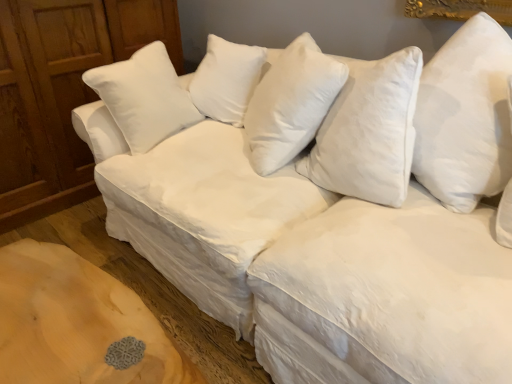
Question: Is white soft pillow at center, the 2th pillow viewed from the front, not near white soft pillow at upper right, the second pillow positioned from the back?

Choices:
 (A) no
 (B) yes

Answer: (A)

Question: Is white soft pillow at center, the 2th pillow viewed from the front, positioned behind white soft pillow at upper right, marked as the 1th pillow in a right-to-left arrangement?

Choices:
 (A) no
 (B) yes

Answer: (B)

Question: Would you say white soft pillow at center, the 1th pillow from the left, is outside white soft pillow at upper right, marked as the 1th pillow in a right-to-left arrangement?

Choices:
 (A) yes
 (B) no

Answer: (A)

Question: Can you confirm if white soft pillow at center, the 2th pillow viewed from the front, is positioned to the left of white soft pillow at upper right, which is counted as the 2th pillow, starting from the left?

Choices:
 (A) yes
 (B) no

Answer: (A)

Question: From the image's perspective, is white soft pillow at center, the 2th pillow viewed from the front, above white soft pillow at upper right, marked as the 1th pillow in a right-to-left arrangement?

Choices:
 (A) yes
 (B) no

Answer: (A)

Question: Based on their positions, is wooden dresser at left located to the left or right of white soft pillow at center, the 2th pillow viewed from the front?

Choices:
 (A) right
 (B) left

Answer: (B)

Question: In terms of height, does wooden dresser at left look taller or shorter compared to white soft pillow at center, the second pillow when ordered from right to left?

Choices:
 (A) short
 (B) tall

Answer: (B)

Question: Is point (87, 96) positioned closer to the camera than point (335, 86)?

Choices:
 (A) farther
 (B) closer

Answer: (A)

Question: From a real-world perspective, is wooden dresser at left above or below white soft pillow at center, the 1th pillow positioned from the back?

Choices:
 (A) above
 (B) below

Answer: (B)

Question: Considering the positions of point (273, 125) and point (134, 16), is point (273, 125) closer or farther from the camera than point (134, 16)?

Choices:
 (A) farther
 (B) closer

Answer: (B)

Question: Based on their positions, is white soft pillow at center, the 2th pillow viewed from the front, located to the left or right of wooden dresser at left?

Choices:
 (A) left
 (B) right

Answer: (B)

Question: From the image's perspective, relative to wooden dresser at left, is white soft pillow at center, the 1th pillow from the left, above or below?

Choices:
 (A) below
 (B) above

Answer: (A)

Question: In terms of size, does white soft pillow at center, the second pillow when ordered from right to left, appear bigger or smaller than wooden dresser at left?

Choices:
 (A) small
 (B) big

Answer: (A)

Question: From a real-world perspective, is white soft pillow at center, the second pillow when ordered from right to left, positioned above or below white soft pillow at upper right, which is counted as the 2th pillow, starting from the left?

Choices:
 (A) below
 (B) above

Answer: (A)

Question: From the image's perspective, is white soft pillow at center, the 1th pillow from the left, above or below white soft pillow at upper right, the second pillow positioned from the back?

Choices:
 (A) above
 (B) below

Answer: (A)